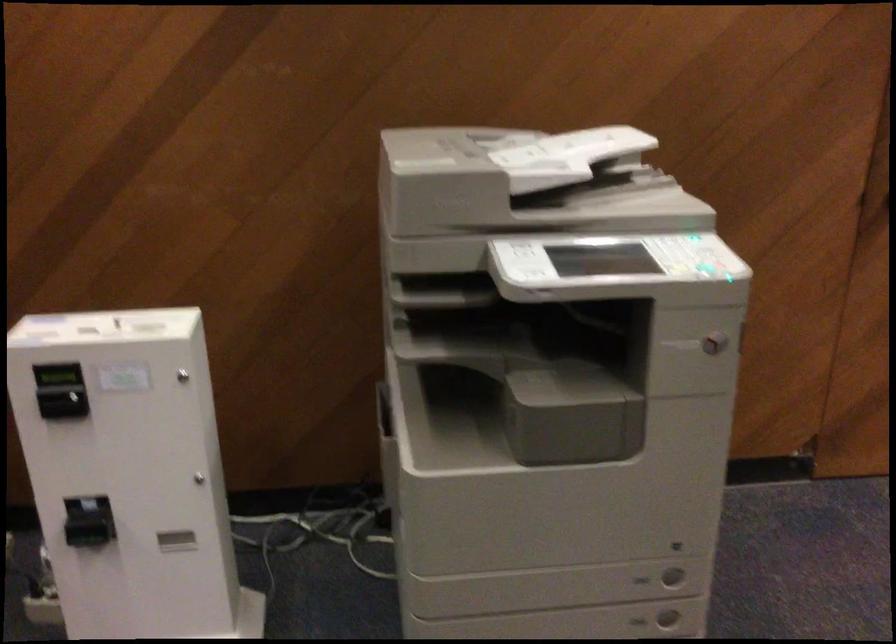
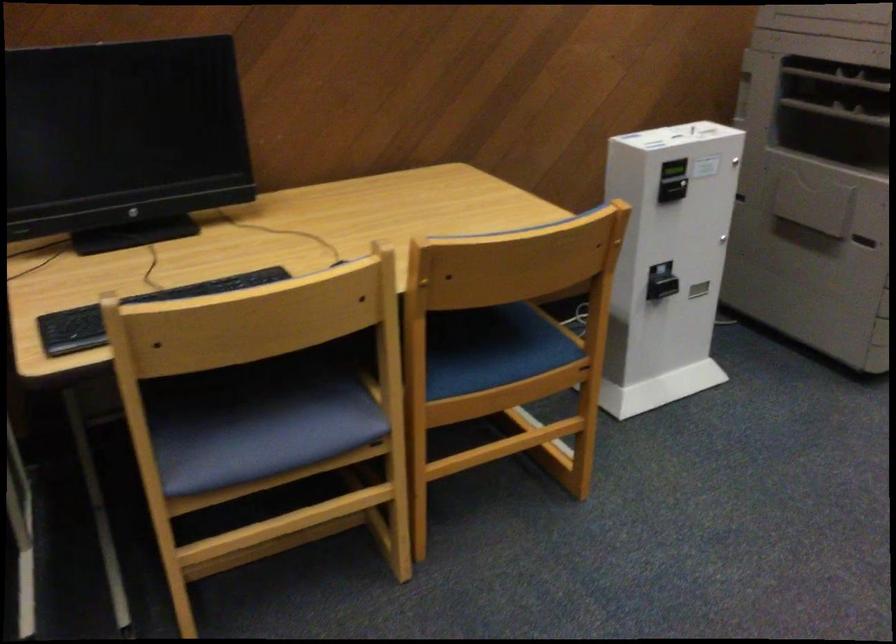
In the second image, find the point that corresponds to (82,381) in the first image.

(673, 169)